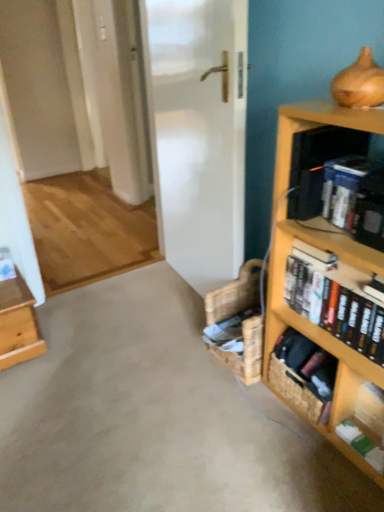
Question: Could you tell me if hardcover books at right, the second book when ordered from top to bottom, is turned towards blue hardcover book at upper right, which ranks as the 3th book in bottom-to-top order?

Choices:
 (A) no
 (B) yes

Answer: (A)

Question: Is hardcover books at right, the 2th book from the bottom, located outside blue hardcover book at upper right, which ranks as the 3th book in bottom-to-top order?

Choices:
 (A) yes
 (B) no

Answer: (A)

Question: Can you confirm if hardcover books at right, the 2th book from the bottom, is bigger than blue hardcover book at upper right, which ranks as the first book in top-to-bottom order?

Choices:
 (A) no
 (B) yes

Answer: (B)

Question: From a real-world perspective, is hardcover books at right, the 2th book from the bottom, located higher than blue hardcover book at upper right, which ranks as the 3th book in bottom-to-top order?

Choices:
 (A) no
 (B) yes

Answer: (A)

Question: Considering the relative positions of hardcover books at right, the second book when ordered from top to bottom, and blue hardcover book at upper right, which ranks as the 3th book in bottom-to-top order, in the image provided, is hardcover books at right, the second book when ordered from top to bottom, behind blue hardcover book at upper right, which ranks as the 3th book in bottom-to-top order,?

Choices:
 (A) no
 (B) yes

Answer: (A)

Question: From a real-world perspective, is light brown wooden table at left positioned above or below blue hardcover book at upper right, which ranks as the 3th book in bottom-to-top order?

Choices:
 (A) below
 (B) above

Answer: (A)

Question: Looking at the image, does light brown wooden table at left seem bigger or smaller compared to blue hardcover book at upper right, which ranks as the first book in top-to-bottom order?

Choices:
 (A) big
 (B) small

Answer: (A)

Question: Considering the positions of light brown wooden table at left and blue hardcover book at upper right, which ranks as the first book in top-to-bottom order, in the image, is light brown wooden table at left wider or thinner than blue hardcover book at upper right, which ranks as the first book in top-to-bottom order,?

Choices:
 (A) wide
 (B) thin

Answer: (A)

Question: In terms of height, does light brown wooden table at left look taller or shorter compared to blue hardcover book at upper right, which ranks as the 3th book in bottom-to-top order?

Choices:
 (A) short
 (B) tall

Answer: (B)

Question: Considering the positions of point (291, 209) and point (26, 344), is point (291, 209) closer or farther from the camera than point (26, 344)?

Choices:
 (A) closer
 (B) farther

Answer: (A)

Question: In terms of height, does black plastic shelf at upper right look taller or shorter compared to light brown wooden table at left?

Choices:
 (A) tall
 (B) short

Answer: (B)

Question: Considering the positions of black plastic shelf at upper right and light brown wooden table at left in the image, is black plastic shelf at upper right wider or thinner than light brown wooden table at left?

Choices:
 (A) wide
 (B) thin

Answer: (B)

Question: From the image's perspective, is black plastic shelf at upper right positioned above or below light brown wooden table at left?

Choices:
 (A) below
 (B) above

Answer: (B)

Question: Is black plastic shelf at upper right wider or thinner than blue hardcover book at upper right, which ranks as the first book in top-to-bottom order?

Choices:
 (A) wide
 (B) thin

Answer: (A)

Question: Is black plastic shelf at upper right spatially inside blue hardcover book at upper right, which ranks as the 3th book in bottom-to-top order, or outside of it?

Choices:
 (A) inside
 (B) outside

Answer: (B)